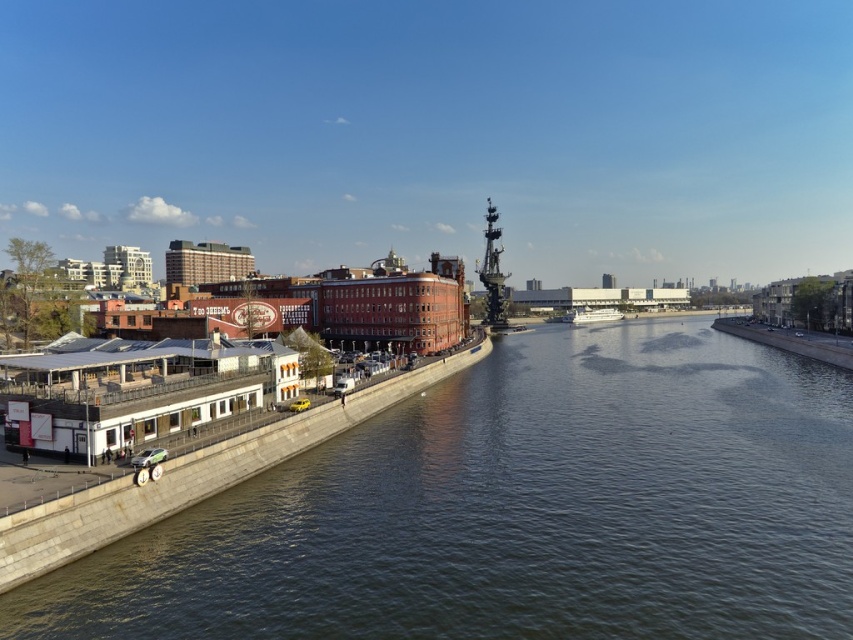
From the picture: You are standing at the riverside and want to take a photo of the two points mentioned. Which point, point (503, 620) or point (579, 316), will appear larger in your camera view?

Point (503, 620) is closer to the camera than point (579, 316), so it will appear larger in the camera view.